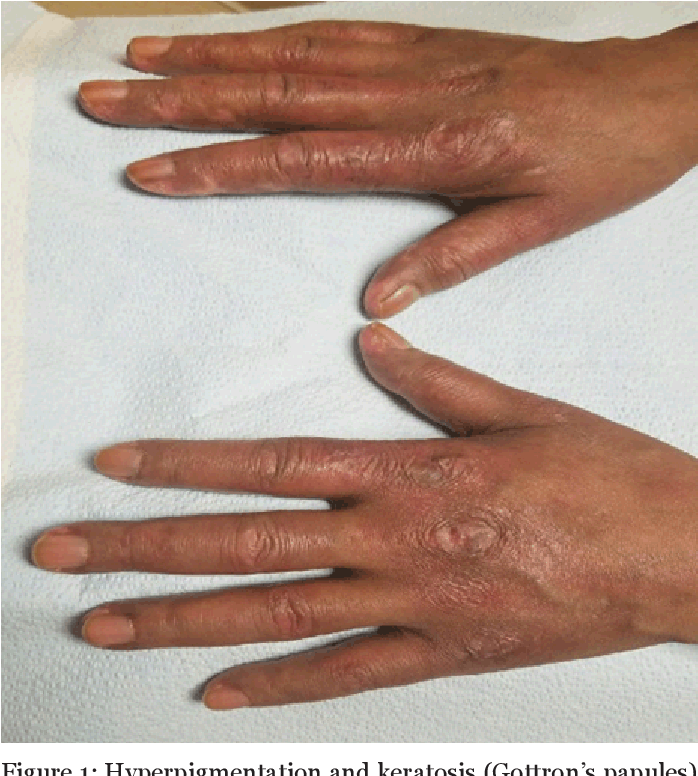
Where is `paint`? paint is located at coordinates (116, 449).